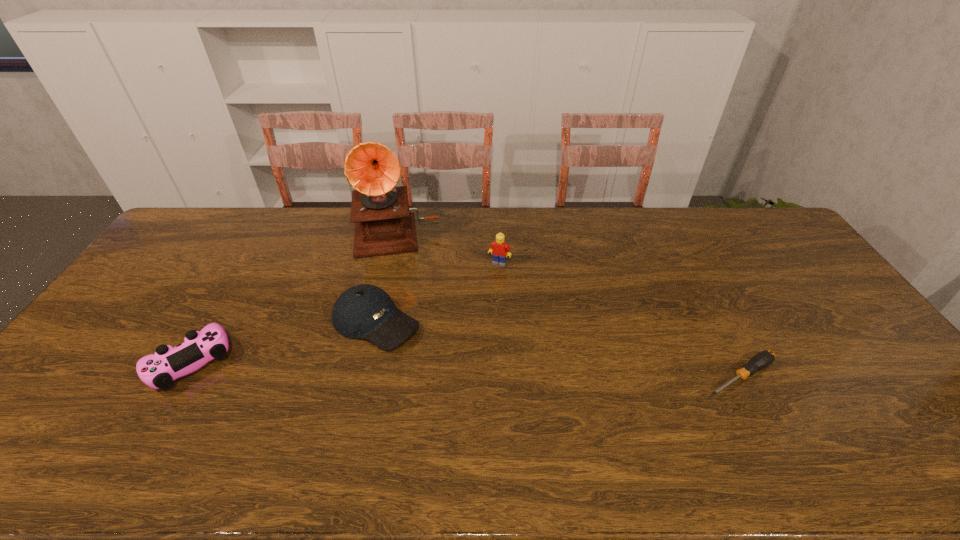
The width and height of the screenshot is (960, 540). Find the location of `free space between the baseball cap and the rightmost object`. free space between the baseball cap and the rightmost object is located at coordinates (558, 349).

What are the coordinates of `free space between the rightmost object and the leftmost object` in the screenshot? It's located at (465, 369).

The image size is (960, 540). What are the coordinates of `free spot between the shortest object and the baseball cap` in the screenshot? It's located at (558, 349).

This screenshot has width=960, height=540. In order to click on vacant space that's between the rightmost object and the baseball cap in this screenshot , I will do `click(558, 349)`.

I want to click on vacant area between the second tallest object and the farthest object, so point(447,248).

The image size is (960, 540). What are the coordinates of `vacant space in between the control and the shortest object` in the screenshot? It's located at (465, 369).

Point out which object is positioned as the third nearest to the Lego. Please provide its 2D coordinates. Your answer should be formatted as a tuple, i.e. [(x, y)], where the tuple contains the x and y coordinates of a point satisfying the conditions above.

[(761, 360)]

At what (x,y) coordinates should I click in order to perform the action: click on object that is the nearest to the farthest object. Please return your answer as a coordinate pair (x, y). Looking at the image, I should click on (364, 311).